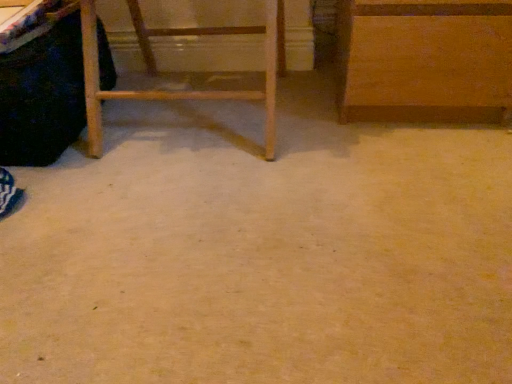
This screenshot has height=384, width=512. What do you see at coordinates (424, 60) in the screenshot?
I see `wooden cabinet at upper right, arranged as the first furniture when viewed from the right` at bounding box center [424, 60].

You are a GUI agent. You are given a task and a screenshot of the screen. Output one action in this format:
    pyautogui.click(x=<x>, y=<y>)
    Task: Click on the wooden ladder at left, the 2th furniture when ordered from right to left
    The height and width of the screenshot is (384, 512).
    Given the screenshot: What is the action you would take?
    pyautogui.click(x=181, y=73)

Find the location of `wooden cabinet at upper right, the 2th furniture from the left`. wooden cabinet at upper right, the 2th furniture from the left is located at coordinates pos(424,60).

From the image's perspective, is wooden cabinet at upper right, the 2th furniture from the left, on top of black fabric vanity at left?

Correct, wooden cabinet at upper right, the 2th furniture from the left, appears higher than black fabric vanity at left in the image.

Which object is positioned more to the right, wooden cabinet at upper right, the 2th furniture from the left, or black fabric vanity at left?

Positioned to the right is wooden cabinet at upper right, the 2th furniture from the left.

Considering the relative sizes of wooden cabinet at upper right, arranged as the first furniture when viewed from the right, and black fabric vanity at left in the image provided, is wooden cabinet at upper right, arranged as the first furniture when viewed from the right, bigger than black fabric vanity at left?

Correct, wooden cabinet at upper right, arranged as the first furniture when viewed from the right, is larger in size than black fabric vanity at left.

Choose the correct answer: Is wooden cabinet at upper right, the 2th furniture from the left, inside black fabric vanity at left or outside it?

wooden cabinet at upper right, the 2th furniture from the left, lies outside black fabric vanity at left.

Could you tell me if black fabric vanity at left is turned towards wooden cabinet at upper right, the 2th furniture from the left?

No, black fabric vanity at left is not facing towards wooden cabinet at upper right, the 2th furniture from the left.

Are black fabric vanity at left and wooden cabinet at upper right, arranged as the first furniture when viewed from the right, located far from each other?

black fabric vanity at left is near wooden cabinet at upper right, arranged as the first furniture when viewed from the right, not far away.

At what (x,y) coordinates should I click in order to perform the action: click on the 2nd furniture to the right when counting from the black fabric vanity at left. Please return your answer as a coordinate pair (x, y). Looking at the image, I should click on (424, 60).

Between wooden ladder at left, the first furniture positioned from the left, and wooden cabinet at upper right, the 2th furniture from the left, which one is positioned in front?

wooden ladder at left, the first furniture positioned from the left, is closer to the camera.

Is wooden ladder at left, the 2th furniture when ordered from right to left, placed right next to wooden cabinet at upper right, the 2th furniture from the left?

No, wooden ladder at left, the 2th furniture when ordered from right to left, is not next to wooden cabinet at upper right, the 2th furniture from the left.

From a real-world perspective, between wooden ladder at left, the 2th furniture when ordered from right to left, and wooden cabinet at upper right, arranged as the first furniture when viewed from the right, who is vertically lower?

wooden cabinet at upper right, arranged as the first furniture when viewed from the right, is physically lower.

Where is `furniture on the left of the wooden cabinet at upper right, arranged as the first furniture when viewed from the right`? furniture on the left of the wooden cabinet at upper right, arranged as the first furniture when viewed from the right is located at coordinates (181, 73).

Which of these two, black fabric vanity at left or wooden ladder at left, the first furniture positioned from the left, stands shorter?

With less height is black fabric vanity at left.

Is black fabric vanity at left in front of or behind wooden ladder at left, the 2th furniture when ordered from right to left, in the image?

black fabric vanity at left is in front of wooden ladder at left, the 2th furniture when ordered from right to left.

Find the location of a particular element. the 2nd furniture above the black fabric vanity at left (from a real-world perspective) is located at coordinates 181,73.

Is point (36, 61) positioned after point (89, 23)?

No, (36, 61) is closer to viewer.

Is wooden cabinet at upper right, the 2th furniture from the left, shorter than wooden ladder at left, the 2th furniture when ordered from right to left?

Yes.

Does wooden cabinet at upper right, the 2th furniture from the left, touch wooden ladder at left, the 2th furniture when ordered from right to left?

No, wooden cabinet at upper right, the 2th furniture from the left, is not in contact with wooden ladder at left, the 2th furniture when ordered from right to left.

Which object is further away from the camera taking this photo, wooden cabinet at upper right, the 2th furniture from the left, or wooden ladder at left, the first furniture positioned from the left?

wooden cabinet at upper right, the 2th furniture from the left, is further from the camera.

From the image's perspective, who appears lower, wooden cabinet at upper right, the 2th furniture from the left, or wooden ladder at left, the first furniture positioned from the left?

wooden ladder at left, the first furniture positioned from the left, is shown below in the image.

In terms of height, does wooden ladder at left, the 2th furniture when ordered from right to left, look taller or shorter compared to black fabric vanity at left?

Clearly, wooden ladder at left, the 2th furniture when ordered from right to left, is taller compared to black fabric vanity at left.

From a real-world perspective, relative to black fabric vanity at left, is wooden ladder at left, the 2th furniture when ordered from right to left, vertically above or below?

Clearly, from a real-world perspective, wooden ladder at left, the 2th furniture when ordered from right to left, is above black fabric vanity at left.

Is wooden ladder at left, the first furniture positioned from the left, facing towards black fabric vanity at left?

No, wooden ladder at left, the first furniture positioned from the left, is not turned towards black fabric vanity at left.

Which object is wider, wooden ladder at left, the 2th furniture when ordered from right to left, or black fabric vanity at left?

black fabric vanity at left is wider.

Image resolution: width=512 pixels, height=384 pixels. I want to click on vanity that appears in front of the wooden cabinet at upper right, the 2th furniture from the left, so click(42, 96).

Identify the location of vanity lying below the wooden cabinet at upper right, arranged as the first furniture when viewed from the right (from the image's perspective). This screenshot has width=512, height=384. (42, 96).

From the picture: Estimate the real-world distances between objects in this image. Which object is closer to black fabric vanity at left, wooden cabinet at upper right, arranged as the first furniture when viewed from the right, or wooden ladder at left, the first furniture positioned from the left?

wooden ladder at left, the first furniture positioned from the left, is positioned closer to the anchor black fabric vanity at left.

Estimate the real-world distances between objects in this image. Which object is further from wooden cabinet at upper right, the 2th furniture from the left, wooden ladder at left, the first furniture positioned from the left, or black fabric vanity at left?

black fabric vanity at left lies further to wooden cabinet at upper right, the 2th furniture from the left, than the other object.

Based on their spatial positions, is black fabric vanity at left or wooden ladder at left, the first furniture positioned from the left, further from wooden cabinet at upper right, the 2th furniture from the left?

Among the two, black fabric vanity at left is located further to wooden cabinet at upper right, the 2th furniture from the left.

Estimate the real-world distances between objects in this image. Which object is further from black fabric vanity at left, wooden ladder at left, the 2th furniture when ordered from right to left, or wooden cabinet at upper right, the 2th furniture from the left?

The object further to black fabric vanity at left is wooden cabinet at upper right, the 2th furniture from the left.

Looking at the image, which one is located further to wooden ladder at left, the first furniture positioned from the left, black fabric vanity at left or wooden cabinet at upper right, the 2th furniture from the left?

wooden cabinet at upper right, the 2th furniture from the left.

Looking at the image, which one is located further to wooden ladder at left, the 2th furniture when ordered from right to left, wooden cabinet at upper right, arranged as the first furniture when viewed from the right, or black fabric vanity at left?

wooden cabinet at upper right, arranged as the first furniture when viewed from the right.

You are a GUI agent. You are given a task and a screenshot of the screen. Output one action in this format:
    pyautogui.click(x=<x>, y=<y>)
    Task: Click on the furniture located between black fabric vanity at left and wooden cabinet at upper right, arranged as the first furniture when viewed from the right, in the left-right direction
    
    Given the screenshot: What is the action you would take?
    pyautogui.click(x=181, y=73)